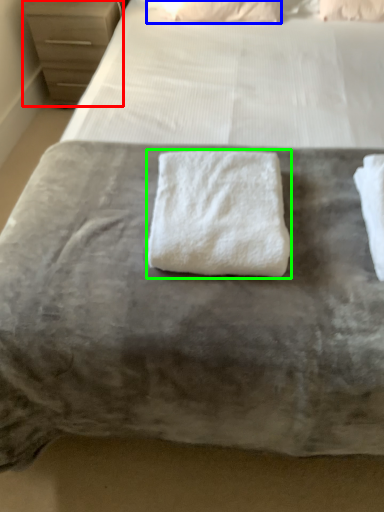
Question: Based on their relative distances, which object is farther from chest of drawers (highlighted by a red box)? Choose from pillow (highlighted by a blue box) and towel (highlighted by a green box).

Choices:
 (A) pillow
 (B) towel

Answer: (B)